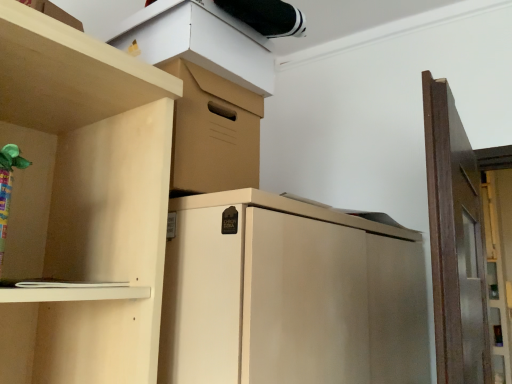
Question: From a real-world perspective, is brown wooden door at right physically located above or below matte cardboard box at upper center?

Choices:
 (A) below
 (B) above

Answer: (A)

Question: In the image, is brown wooden door at right on the left side or the right side of matte cardboard box at upper center?

Choices:
 (A) right
 (B) left

Answer: (A)

Question: Considering the positions of brown wooden door at right and matte cardboard box at upper center in the image, is brown wooden door at right bigger or smaller than matte cardboard box at upper center?

Choices:
 (A) big
 (B) small

Answer: (A)

Question: From the image's perspective, is matte cardboard box at upper center above or below brown wooden door at right?

Choices:
 (A) below
 (B) above

Answer: (B)

Question: Relative to brown wooden door at right, is matte cardboard box at upper center in front or behind?

Choices:
 (A) front
 (B) behind

Answer: (B)

Question: Do you think matte cardboard box at upper center is within brown wooden door at right, or outside of it?

Choices:
 (A) outside
 (B) inside

Answer: (A)

Question: Considering the positions of matte cardboard box at upper center and brown wooden door at right in the image, is matte cardboard box at upper center taller or shorter than brown wooden door at right?

Choices:
 (A) short
 (B) tall

Answer: (A)